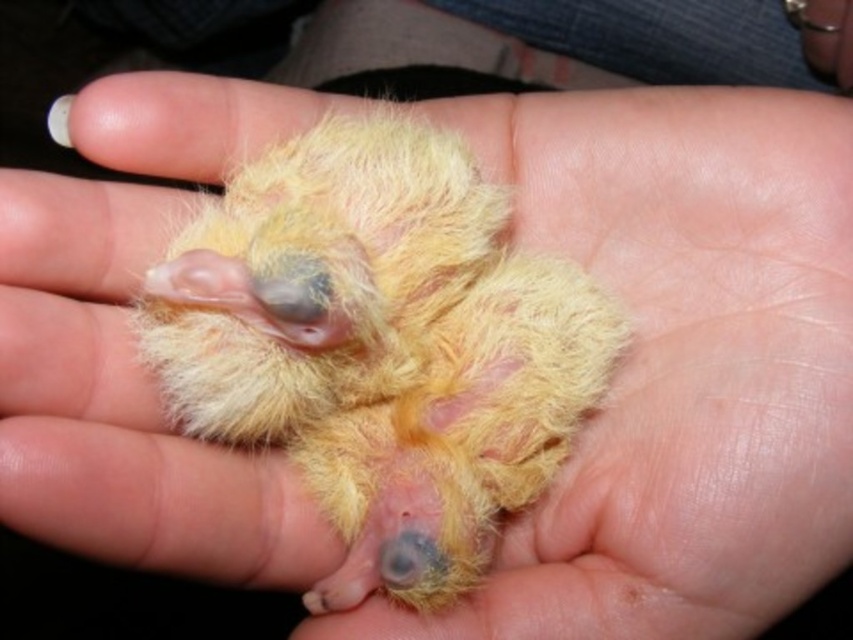
You are a wildlife rehabilitator assessing a bird rescue situation. You see a fluffy yellow bird at center and a yellow downy feather at center. Which object is bigger in size?

The fluffy yellow bird at center is larger in size compared to the yellow downy feather at center.

You are a wildlife photographer trying to capture a closeup shot of the fluffy yellow bird at center. According to the coordinates provided, where should you position your camera relative to the bird to ensure it is centered in your frame?

The fluffy yellow bird at center is located at coordinates point (381, 346), so you should position your camera directly facing the bird at those coordinates to center it in your frame.